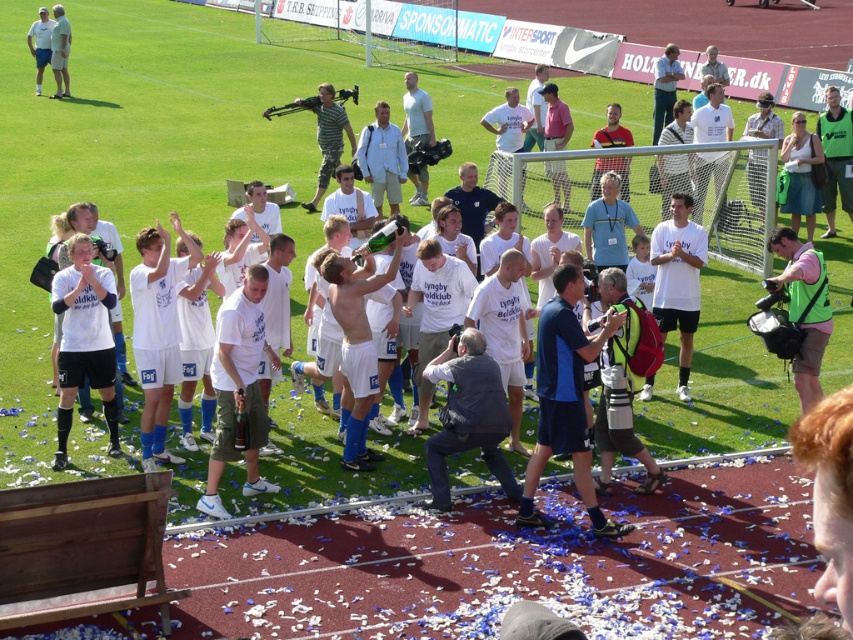
Question: Based on their relative distances, which object is nearer to the blue fabric jacket at center?

Choices:
 (A) green fabric vest at lower right
 (B) white t-shirt at center

Answer: (A)

Question: Can you confirm if white matte shirt at center is smaller than light blue shirt at upper left?

Choices:
 (A) yes
 (B) no

Answer: (A)

Question: Does blue fabric jacket at center appear over light blue shirt at upper left?

Choices:
 (A) yes
 (B) no

Answer: (B)

Question: Among these objects, which one is farthest from the camera?

Choices:
 (A) green fabric vest at lower right
 (B) blue fabric jacket at center
 (C) light blue shirt at upper left
 (D) matte white jersey at left

Answer: (C)

Question: Is blue fabric jacket at center to the right of white matte shirt at center from the viewer's perspective?

Choices:
 (A) no
 (B) yes

Answer: (A)

Question: Which point appears closest to the camera in this image?

Choices:
 (A) (822, 300)
 (B) (44, 19)
 (C) (57, 413)
 (D) (582, 449)

Answer: (D)